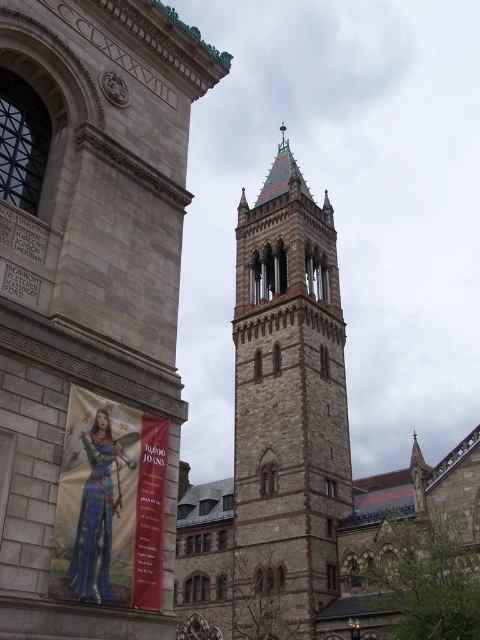
You are standing in front of the historic stone building and notice two points marked on the structure. The first point is located at coordinates point (88, 381) and the second at point (108, 497). Which point is closer to you as you face the building?

Point (108, 497) is closer to you because it is in front of point (88, 381).

You are standing at the entrance of the historic stone building and want to locate the brown stone tower at center. According to the coordinates provided, where should you look relative to the entrance?

The brown stone tower at center is located at coordinates point (287, 408), which means it is positioned to the right and slightly above the entrance area.